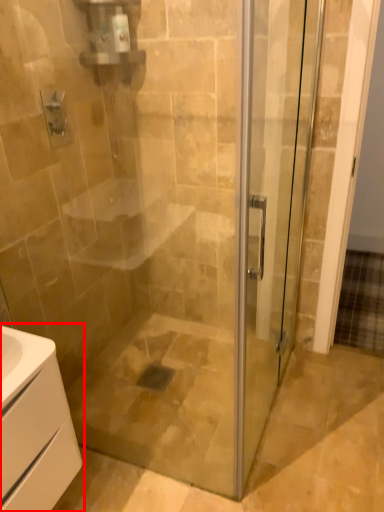
Question: Where is bathroom cabinet (annotated by the red box) located in relation to screen door in the image?

Choices:
 (A) left
 (B) right

Answer: (A)